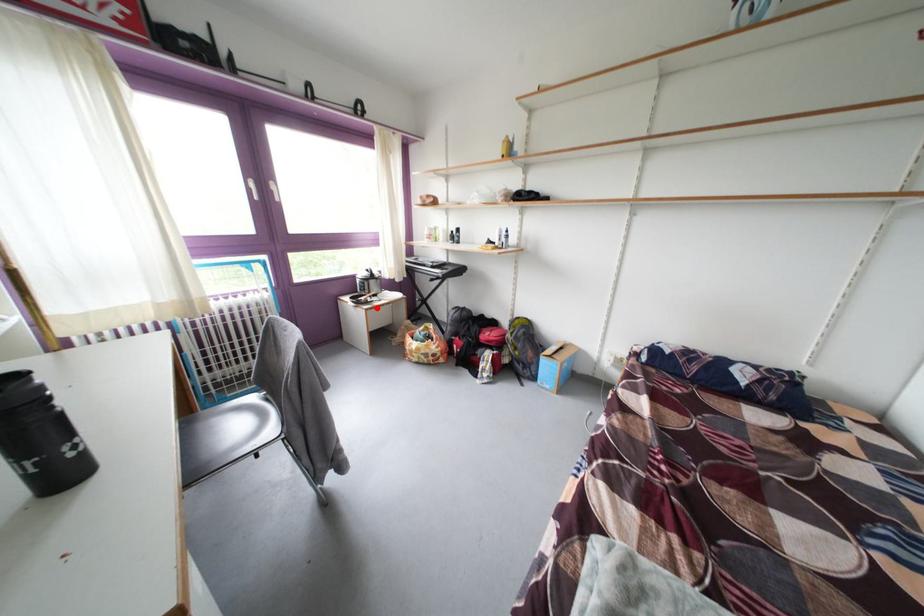
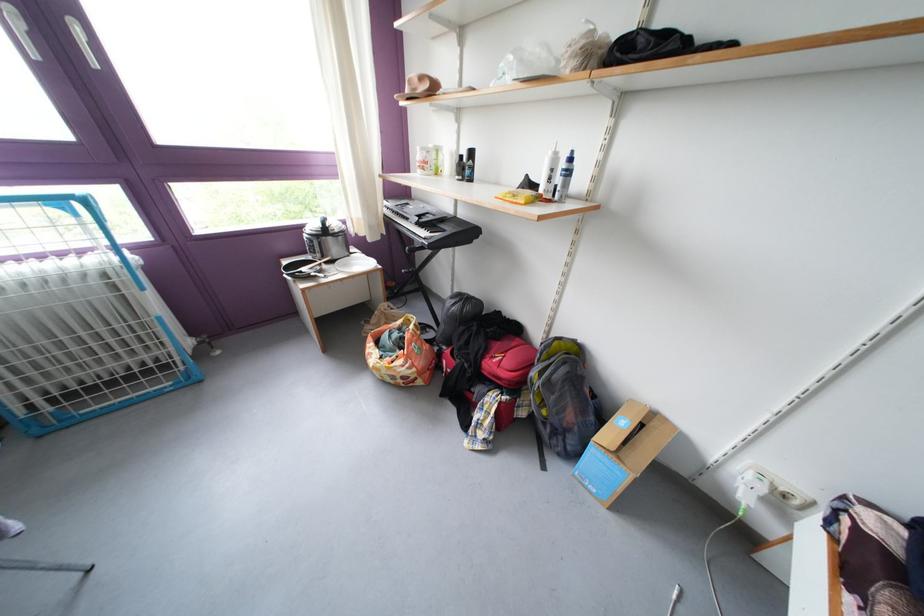
Locate, in the second image, the point that corresponds to the highlighted location in the first image.

(319, 283)